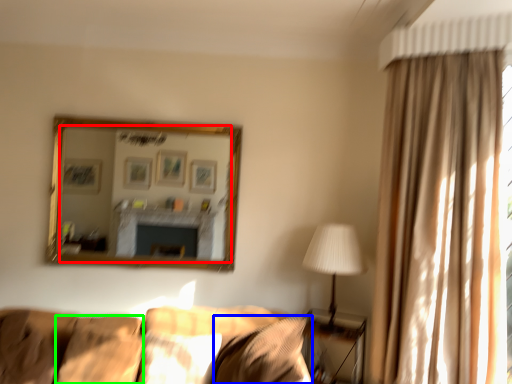
Question: Which is nearer to the mirror (highlighted by a red box)? pillow (highlighted by a blue box) or pillow (highlighted by a green box).

Choices:
 (A) pillow
 (B) pillow

Answer: (B)